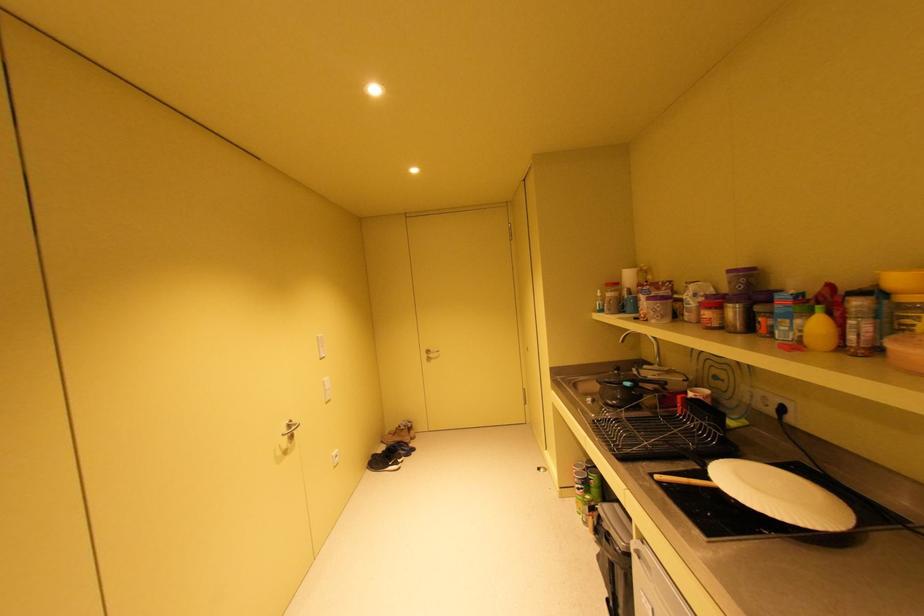
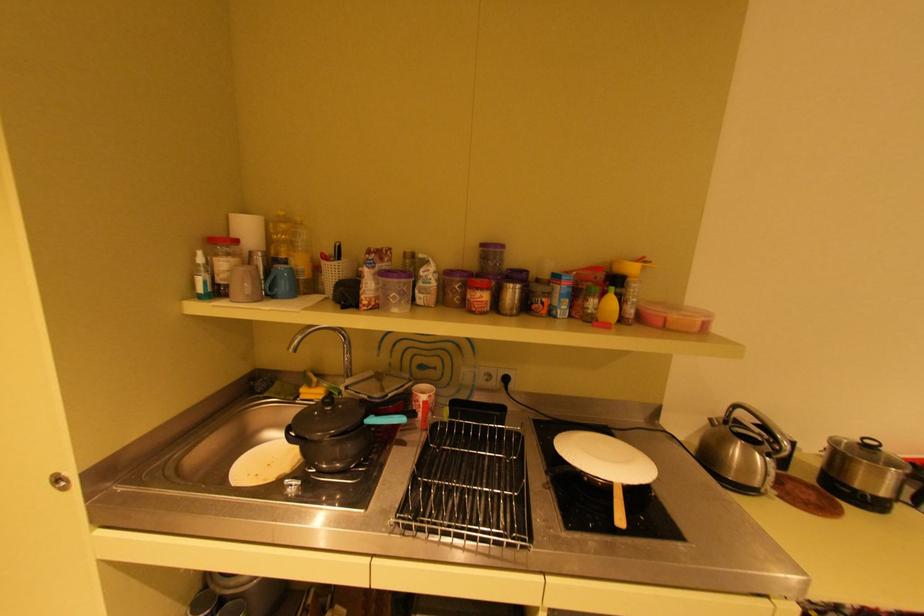
Locate, in the second image, the point that corresponds to the point at 630,384 in the first image.

(371, 424)